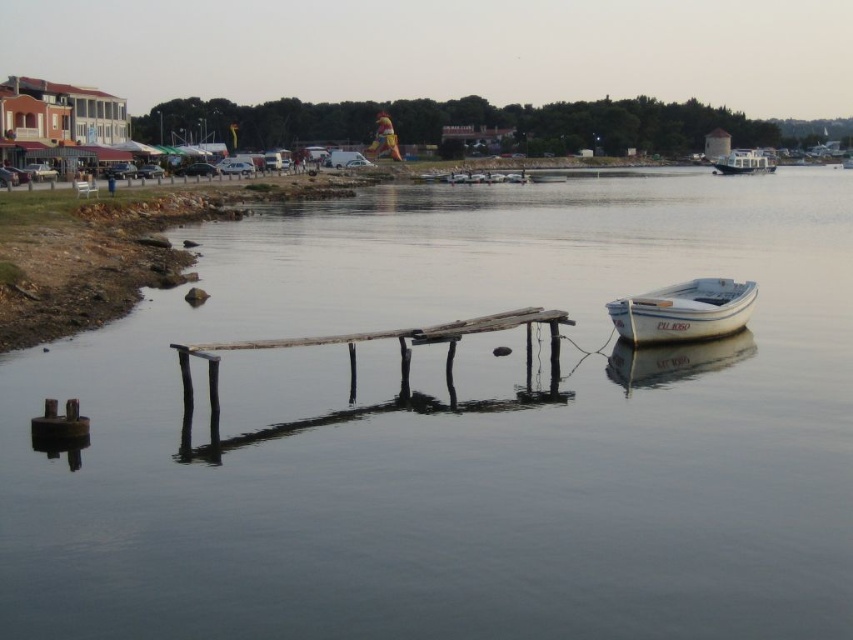
You are standing at the point labeled point at (421, 333). You want to reach the boat moored nearby without getting your feet wet. The rope extending from the pier to the boat is 15.87 meters long. Can you safely walk along the rope to reach the boat?

The rope extending from the pier to the boat is 15.87 meters long. Since the rope is tied to both the pier and the boat, you can safely walk along the rope to reach the boat without getting your feet wet.

Consider the image. You are standing on the wooden pier and want to check the height of the transparent water at center compared to the white matte boat at lower right. Which one has a greater height?

The transparent water at center is taller than the white matte boat at lower right according to the description.

You are standing at the edge of the waterfront scene. The weathered wood dock at center is located at coordinates point 0.531, 0.438. If you want to reach the dock, which direction should you move relative to your current position?

The weathered wood dock at center is located at coordinates point (373, 339). Since you are at the edge of the waterfront scene, you should move towards the center to reach the dock.